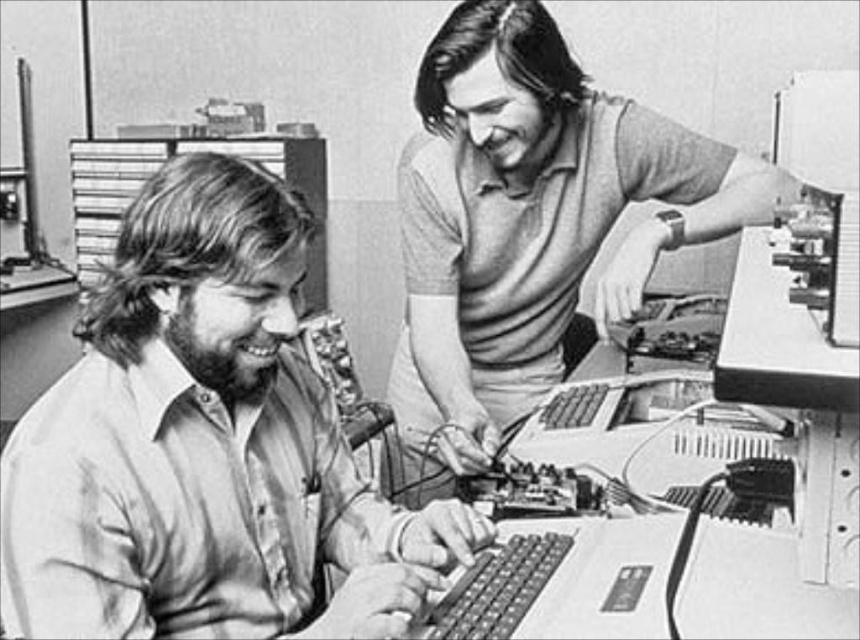
Does light brown shirt at left have a larger size compared to smooth gray shirt at upper right?

Incorrect, light brown shirt at left is not larger than smooth gray shirt at upper right.

Does point (335, 416) come closer to viewer compared to point (538, 19)?

That is True.

This screenshot has height=640, width=860. I want to click on light brown shirt at left, so click(204, 445).